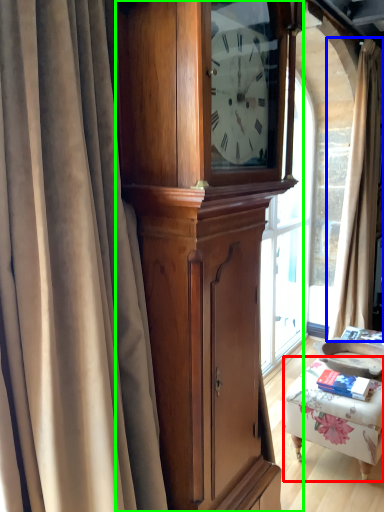
Question: Which is farther away from furniture (highlighted by a red box)? curtain (highlighted by a blue box) or cabinetry (highlighted by a green box)?

Choices:
 (A) curtain
 (B) cabinetry

Answer: (A)